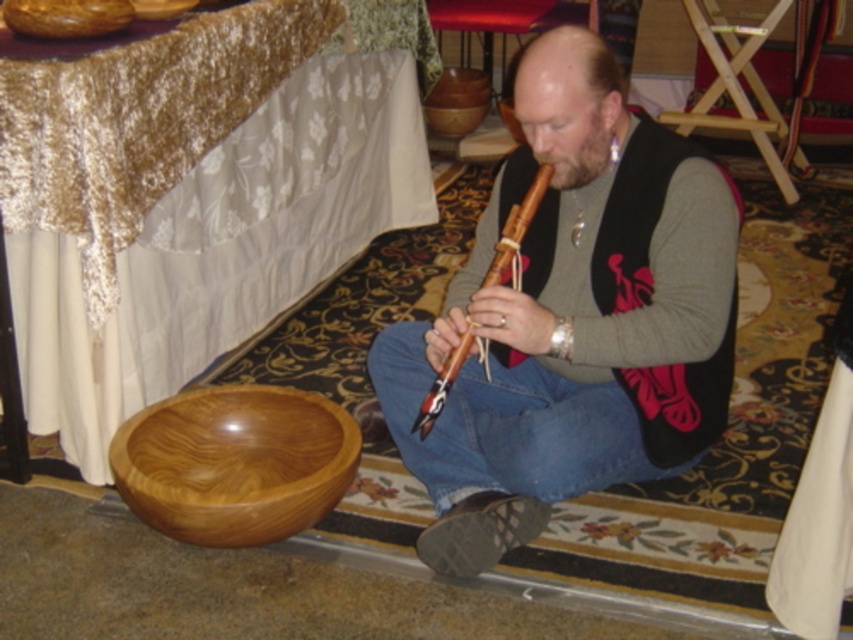
Question: Does wooden tablecloth at lower left have a larger size compared to matte wood flute at center?

Choices:
 (A) no
 (B) yes

Answer: (B)

Question: Does wooden tablecloth at lower left have a smaller size compared to shiny brown wooden bowl at lower left?

Choices:
 (A) yes
 (B) no

Answer: (B)

Question: Which of the following is the farthest from the observer?

Choices:
 (A) (462, 353)
 (B) (54, 294)
 (C) (274, 436)
 (D) (592, 403)

Answer: (C)

Question: Among these objects, which one is farthest from the camera?

Choices:
 (A) wooden flute at center
 (B) shiny brown wooden bowl at lower left
 (C) matte wood flute at center
 (D) wooden tablecloth at lower left

Answer: (D)

Question: Does wooden tablecloth at lower left have a greater width compared to shiny brown wooden bowl at lower left?

Choices:
 (A) no
 (B) yes

Answer: (B)

Question: Which point is farther to the camera?

Choices:
 (A) wooden tablecloth at lower left
 (B) shiny brown wooden bowl at lower left

Answer: (A)